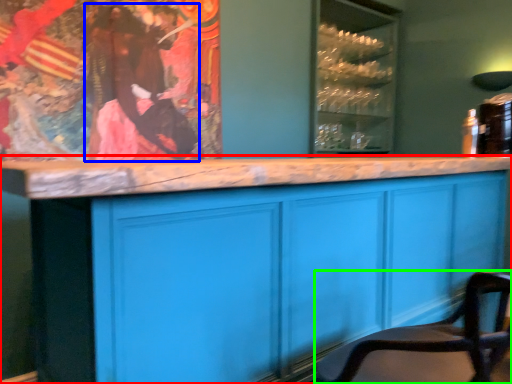
Question: Considering the real-world distances, which object is farthest from cabinetry (highlighted by a red box)? person (highlighted by a blue box) or chair (highlighted by a green box)?

Choices:
 (A) person
 (B) chair

Answer: (A)